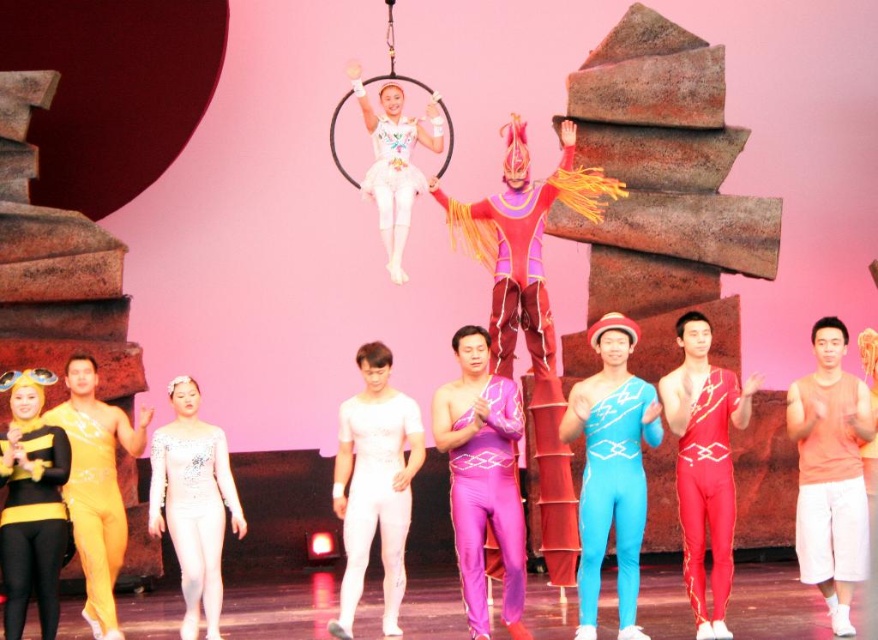
Between point (699, 604) and point (78, 541), which one is positioned in front?

Point (699, 604)

Does shiny red leotard at center have a lesser height compared to yellow spandex bodysuit at left?

In fact, shiny red leotard at center may be taller than yellow spandex bodysuit at left.

Image resolution: width=878 pixels, height=640 pixels. I want to click on shiny red leotard at center, so click(707, 492).

Where is `shiny red leotard at center`? shiny red leotard at center is located at coordinates (707, 492).

Between white satin leotard at center and purple matte jumpsuit at center, which one is positioned lower?

Positioned lower is white satin leotard at center.

Is white satin leotard at center behind purple matte jumpsuit at center?

Yes, white satin leotard at center is further from the viewer.

Is point (224, 516) behind point (473, 477)?

Yes.

I want to click on white satin leotard at center, so click(193, 502).

Is white satin leotard at center closer to camera compared to yellow spandex bodysuit at left?

No, it is not.

Between point (159, 461) and point (98, 621), which one is positioned in front?

Positioned in front is point (98, 621).

Locate an element on the screen. white satin leotard at center is located at coordinates (193, 502).